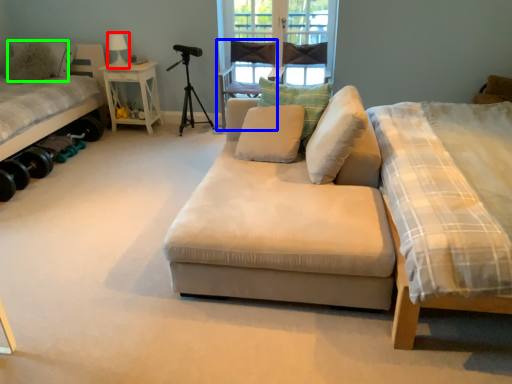
Question: Which object is positioned farthest from table lamp (highlighted by a red box)? Select from armchair (highlighted by a blue box) and pillow (highlighted by a green box).

Choices:
 (A) armchair
 (B) pillow

Answer: (A)